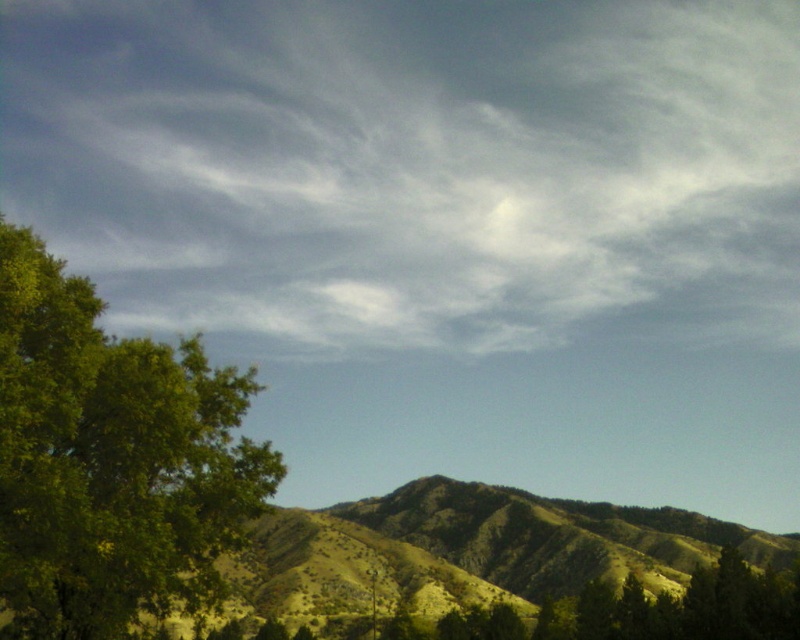
Question: From the image, what is the correct spatial relationship of white fluffy cloud at upper center in relation to green leafy tree at left?

Choices:
 (A) below
 (B) above

Answer: (B)

Question: Does white fluffy cloud at upper center have a greater width compared to green leafy tree at left?

Choices:
 (A) yes
 (B) no

Answer: (A)

Question: Which point is farther to the camera?

Choices:
 (A) green leafy tree at left
 (B) white fluffy cloud at upper center

Answer: (B)

Question: Which point is farther from the camera taking this photo?

Choices:
 (A) (106, 545)
 (B) (692, 49)

Answer: (B)

Question: Which point appears farthest from the camera in this image?

Choices:
 (A) [x=192, y=54]
 (B) [x=150, y=467]

Answer: (A)

Question: Can you confirm if white fluffy cloud at upper center is thinner than green leafy tree at left?

Choices:
 (A) yes
 (B) no

Answer: (B)